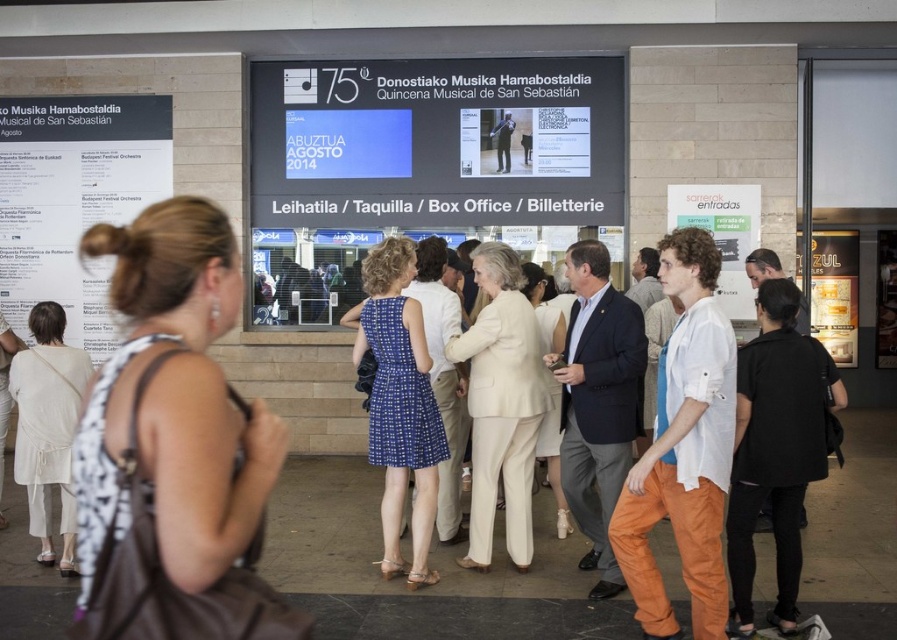
Question: Which of the following is the closest to the observer?

Choices:
 (A) [729, 237]
 (B) [44, 556]
 (C) [678, 412]
 (D) [19, 248]

Answer: (C)

Question: Among these objects, which one is nearest to the camera?

Choices:
 (A) white paper poster at left
 (B) white cotton shirt at center
 (C) white cotton dress at center

Answer: (C)

Question: Can you confirm if white cotton dress at lower left is positioned above metallic gold sign at right?

Choices:
 (A) no
 (B) yes

Answer: (A)

Question: Is white cotton dress at center below white cotton dress at lower left?

Choices:
 (A) yes
 (B) no

Answer: (B)

Question: Where is white cotton dress at center located in relation to white cotton shirt at center in the image?

Choices:
 (A) above
 (B) below

Answer: (B)

Question: Which point is farther to the camera?

Choices:
 (A) white cotton shirt at center
 (B) white cotton dress at lower left

Answer: (B)